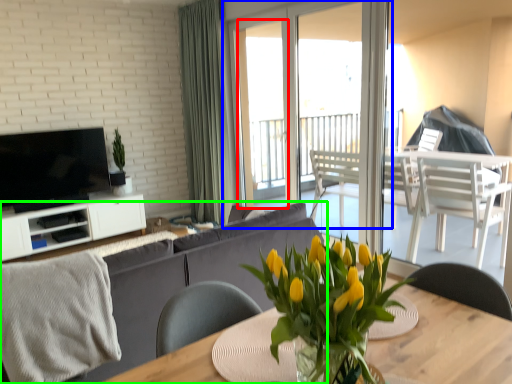
Question: Estimate the real-world distances between objects in this image. Which object is closer to window screen (highlighted by a red box), window (highlighted by a blue box) or studio couch (highlighted by a green box)?

Choices:
 (A) window
 (B) studio couch

Answer: (A)